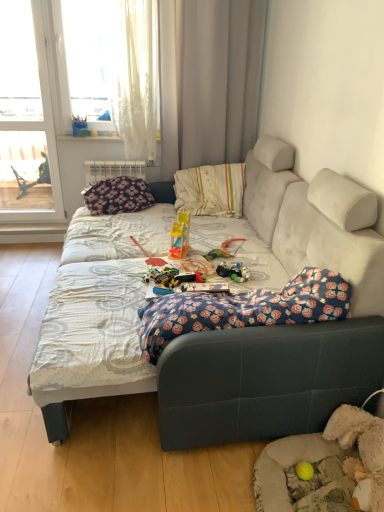
Question: Is yellow rubber ball at lower right, the second toy when ordered from left to right, wider or thinner than floral fabric blanket at center?

Choices:
 (A) wide
 (B) thin

Answer: (B)

Question: Visually, is yellow rubber ball at lower right, marked as the first toy in a right-to-left arrangement, positioned to the left or to the right of floral fabric blanket at center?

Choices:
 (A) left
 (B) right

Answer: (B)

Question: Which of these objects is positioned farthest from the white sheer curtain at upper left, which appears as the 1th window when viewed from the right?

Choices:
 (A) translucent plastic toy at center
 (B) white fabric curtain at upper center
 (C) fluffy beige dog bed at lower right
 (D) yellow rubber ball at lower right, which appears as the second toy when viewed from the top
 (E) translucent plastic slide at center, acting as the first toy starting from the top

Answer: (D)

Question: Which object is the farthest from the white fabric curtain at upper center?

Choices:
 (A) velvet gray couch at center
 (B) transparent glass window at left, the second window when ordered from right to left
 (C) yellow rubber ball at lower right, placed as the second toy when sorted from back to front
 (D) translucent plastic toy at center
 (E) floral fabric blanket at center

Answer: (C)